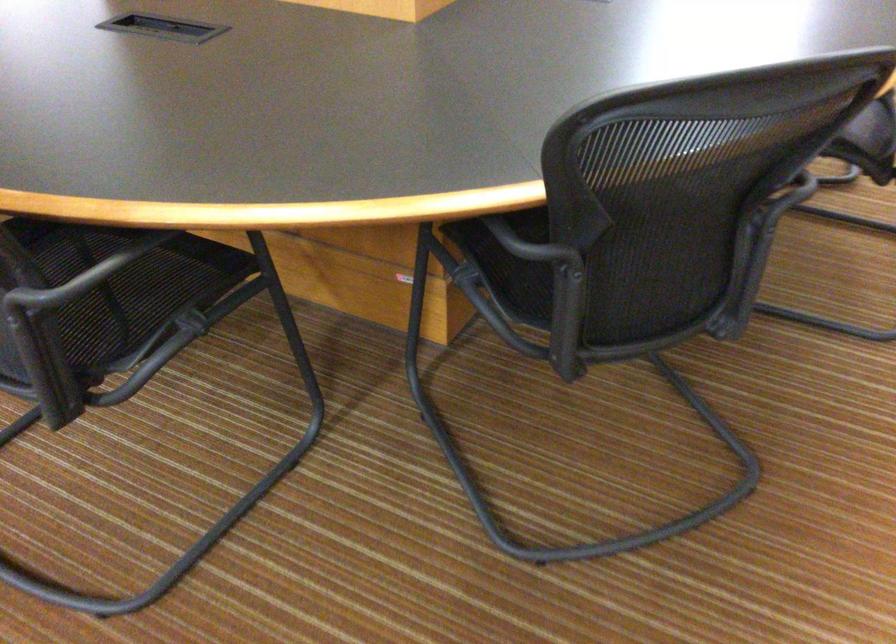
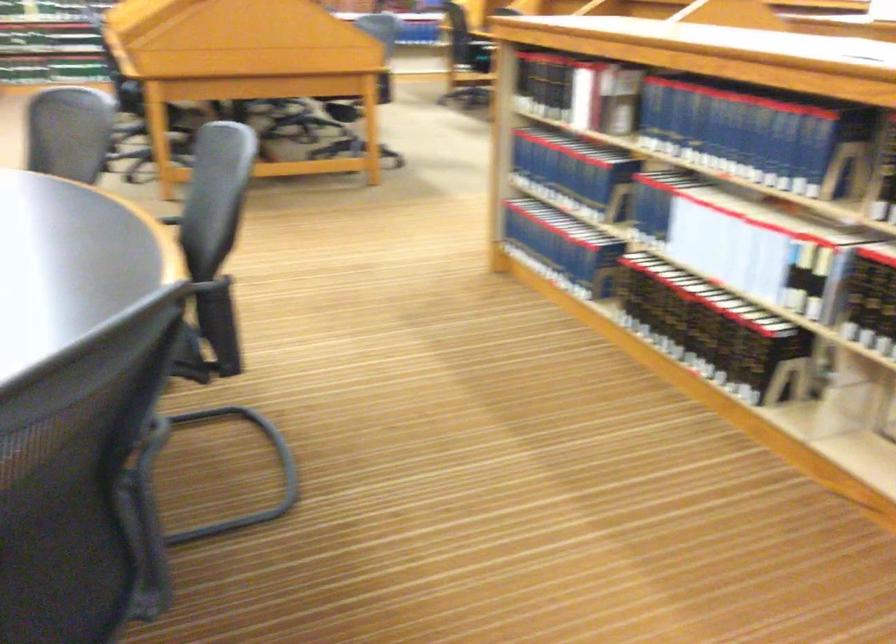
Question: The first image is from the beginning of the video and the second image is from the end. How did the camera likely rotate when shooting the video?

Choices:
 (A) Left
 (B) Right
 (C) Up
 (D) Down

Answer: (B)